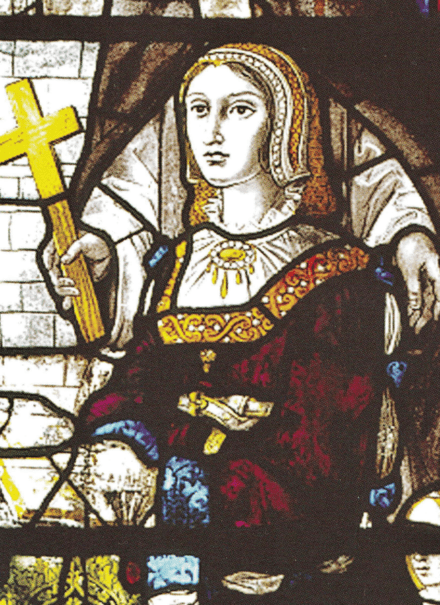
At what (x,y) coordinates should I click in order to perform the action: click on scattered small blue stained glass panels. Please return your answer as a coordinate pair (x, y). Looking at the image, I should click on (175, 567), (190, 485), (386, 501), (142, 433), (401, 370), (386, 267), (160, 256).